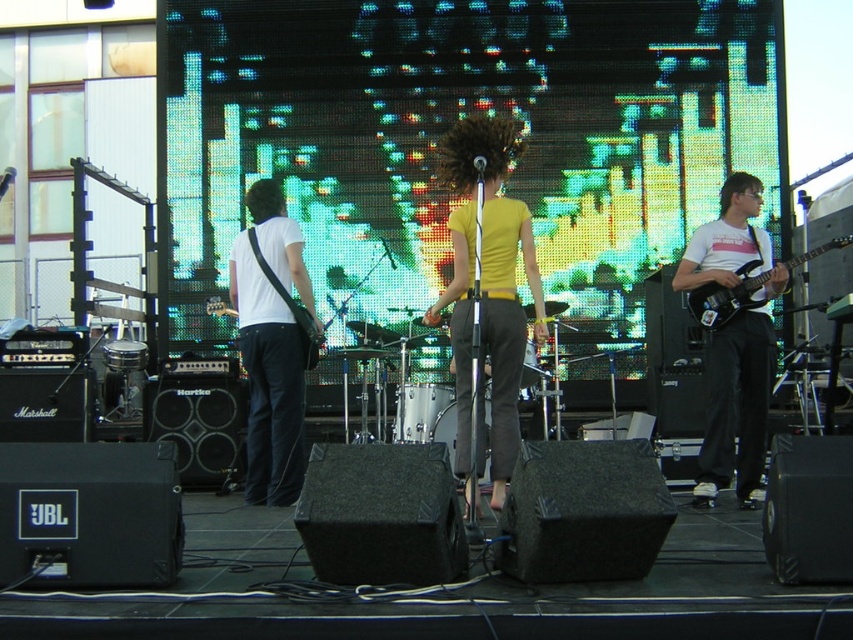
In the scene shown: You are a photographer at the live music performance. You want to capture a photo of the yellow matte shirt at center and the black glossy electric guitar at right. Can you position yourself so that both are fully visible in the frame without any obstruction?

The yellow matte shirt at center is in front of the black glossy electric guitar at right, so positioning yourself to capture both fully visible would require ensuring the photographer angles the camera so the yellow matte shirt at center does not block the view of the black glossy electric guitar at right.

You are standing in the audience watching the live music performance. There are two points marked in the image. The first point is at coordinates point (498, 257) and the second point is at coordinates point (730, 202). Which of these two points appears closer to you?

Point (498, 257) is closer to the viewer than point (730, 202).

You are a stagehand setting up equipment for the next act. You need to move the matte black electric guitar at right and the matte black guitar at left to the storage room. Which guitar should you move first if you want to move the one closer to the front of the stage?

The matte black electric guitar at right is in front of the matte black guitar at left, so you should move the matte black electric guitar at right first since it is closer to the front of the stage.